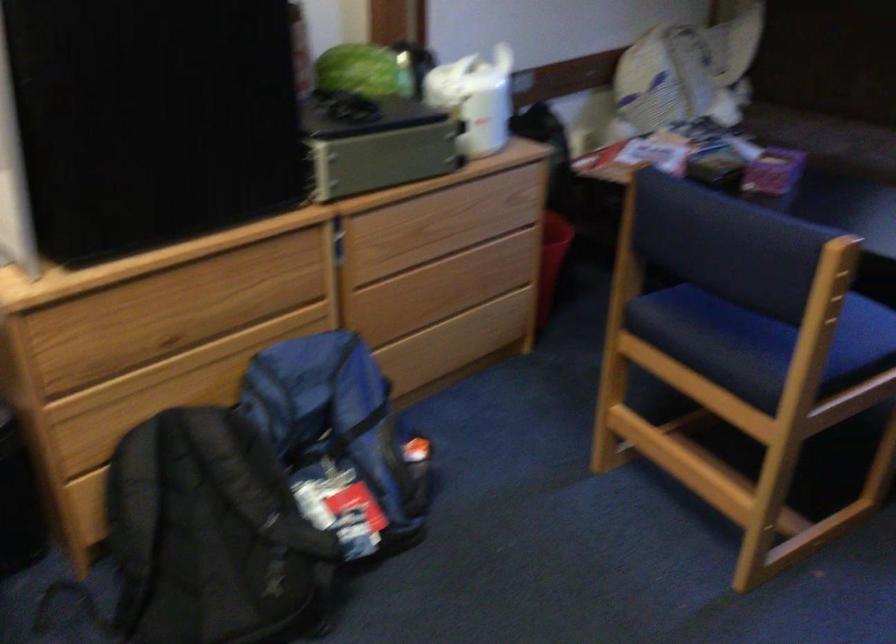
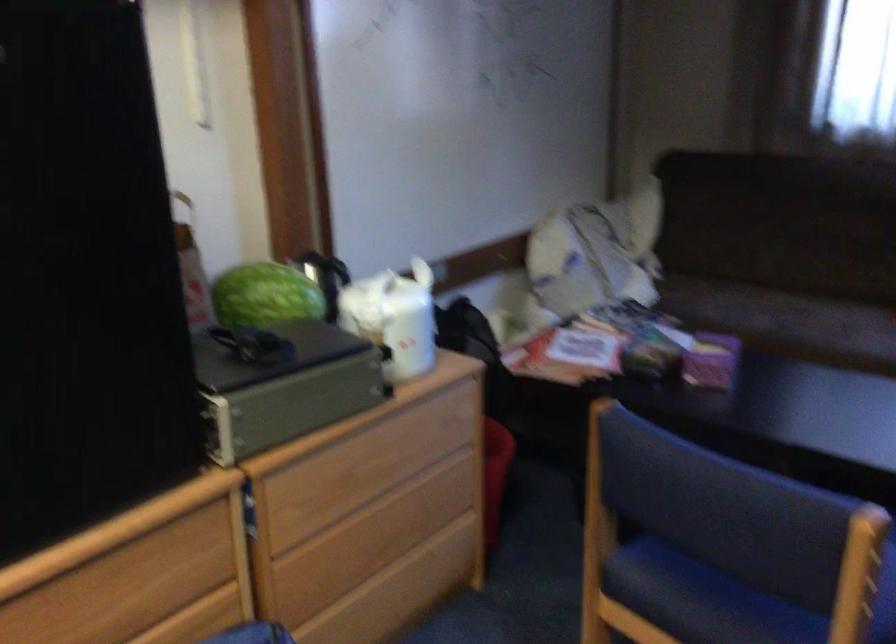
Locate, in the second image, the point that corresponds to pixel 771 165 in the first image.

(711, 361)